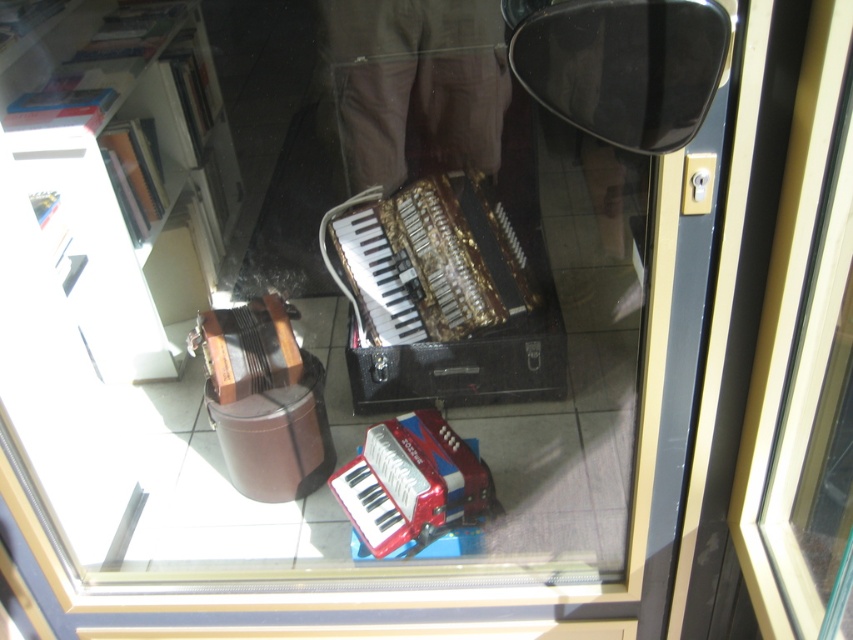
Is point (196, 173) farther from camera compared to point (433, 410)?

That is True.

Between white glossy bookshelf at upper left and metallic red accordion at center, which one appears on the right side from the viewer's perspective?

From the viewer's perspective, metallic red accordion at center appears more on the right side.

Where is `white glossy bookshelf at upper left`? The image size is (853, 640). white glossy bookshelf at upper left is located at coordinates (120, 166).

Who is taller, white glossy bookshelf at upper left or gold metallic accordion at center?

white glossy bookshelf at upper left is taller.

Does white glossy bookshelf at upper left have a greater height compared to gold metallic accordion at center?

Yes.

Does point (112, 257) come behind point (419, 212)?

That is False.

Locate an element on the screen. white glossy bookshelf at upper left is located at coordinates (120, 166).

Is gold metallic accordion at center closer to camera compared to metallic red accordion at center?

No, it is not.

Between gold metallic accordion at center and metallic red accordion at center, which one is positioned higher?

gold metallic accordion at center is higher up.

Is point (437, 237) more distant than point (401, 420)?

That is True.

Where is `gold metallic accordion at center`? gold metallic accordion at center is located at coordinates (427, 260).